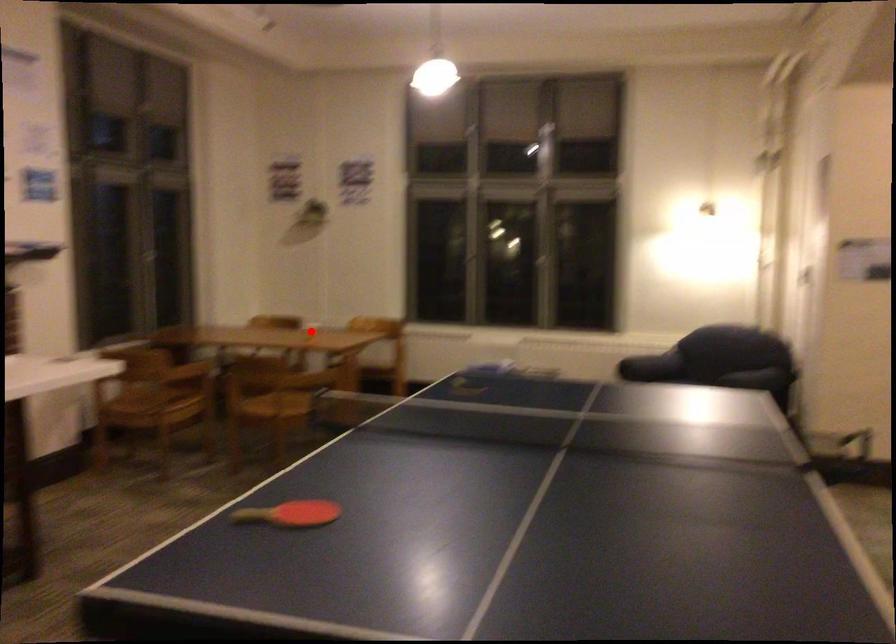
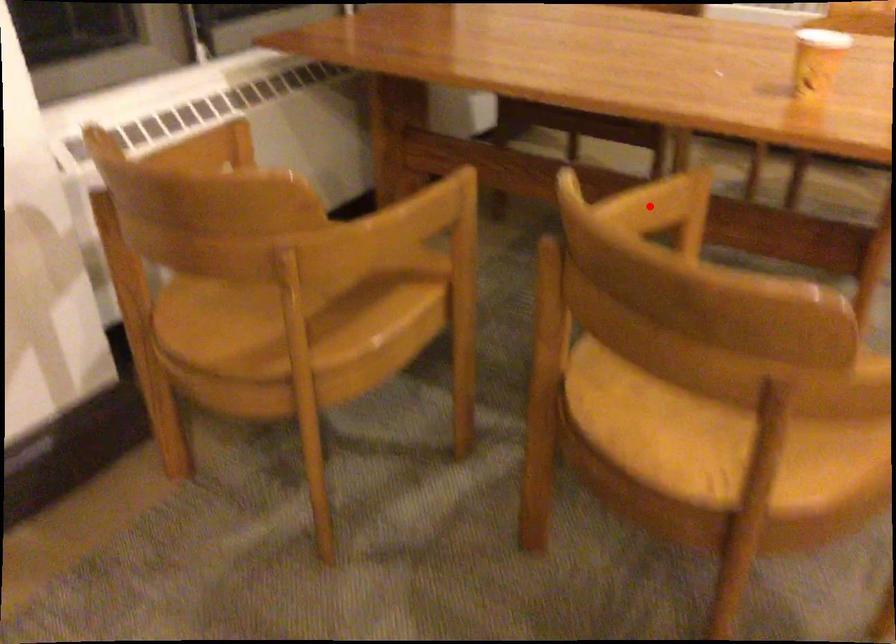
I am providing you with two images of the same scene from different viewpoints. A red point is marked on the first image and another point is marked on the second image. Is the marked point in image1 the same physical position as the marked point in image2?

No